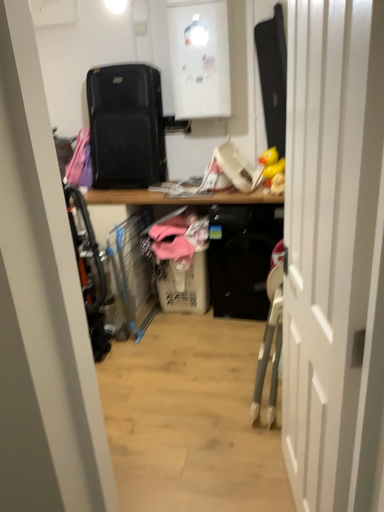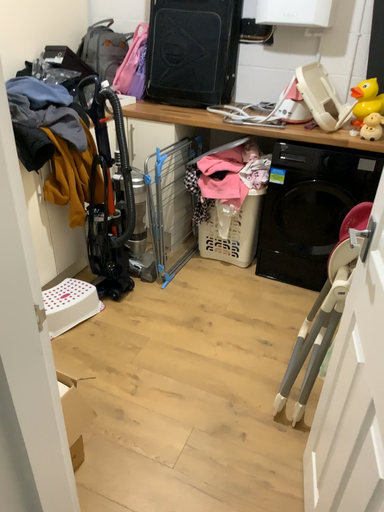
Question: How did the camera likely rotate when shooting the video?

Choices:
 (A) rotated right
 (B) rotated left

Answer: (B)